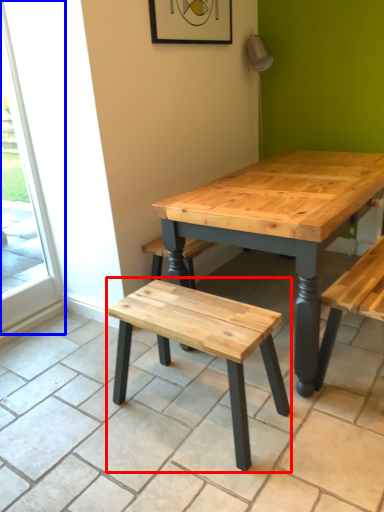
Question: Which point is further to the camera, stool (highlighted by a red box) or screen door (highlighted by a blue box)?

Choices:
 (A) stool
 (B) screen door

Answer: (B)